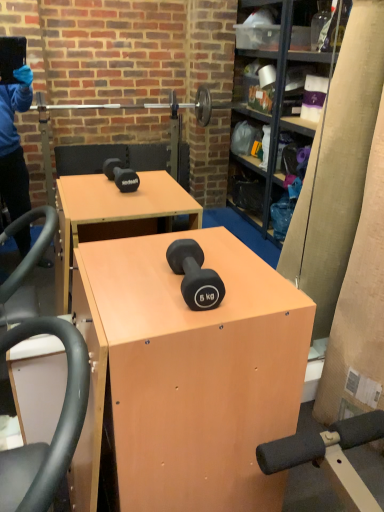
In order to click on vacant space in front of matte black dumbbell at center in this screenshot , I will do `click(173, 321)`.